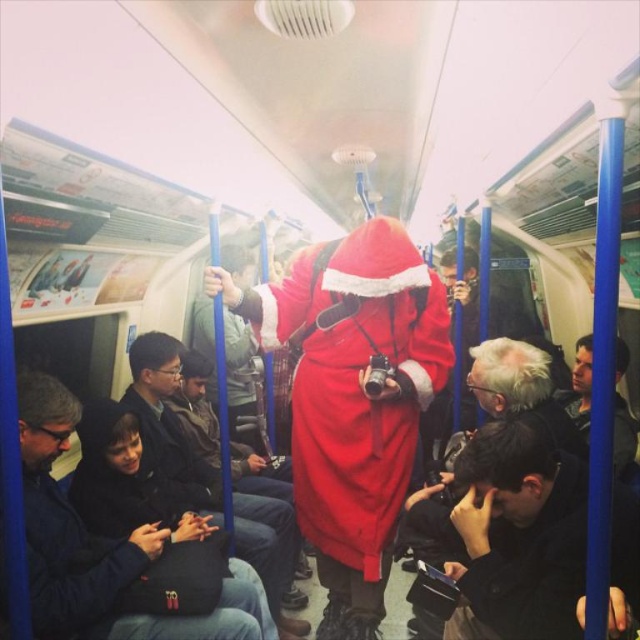
Question: Which object is positioned closest to the velvet red santa at center?

Choices:
 (A) dark brown leather jacket at lower right
 (B) dark gray fabric jacket at lower left
 (C) dark blue fabric jacket at lower left
 (D) smooth black jacket at lower right

Answer: (A)

Question: Does dark brown leather jacket at lower right appear over dark blue fabric jacket at lower left?

Choices:
 (A) no
 (B) yes

Answer: (B)

Question: Among these points, which one is farthest from the camera?

Choices:
 (A) (420, 298)
 (B) (186, 524)
 (C) (170, 371)
 (D) (621, 467)

Answer: (C)

Question: Which object is positioned closest to the dark brown leather jacket at lower right?

Choices:
 (A) velvet red santa at center
 (B) dark gray fabric jacket at lower left

Answer: (A)

Question: Is dark brown leather jacket at lower right bigger than dark blue fabric jacket at lower left?

Choices:
 (A) yes
 (B) no

Answer: (B)

Question: Does dark gray fabric jacket at lower left have a smaller size compared to dark blue fabric jacket at lower left?

Choices:
 (A) yes
 (B) no

Answer: (A)